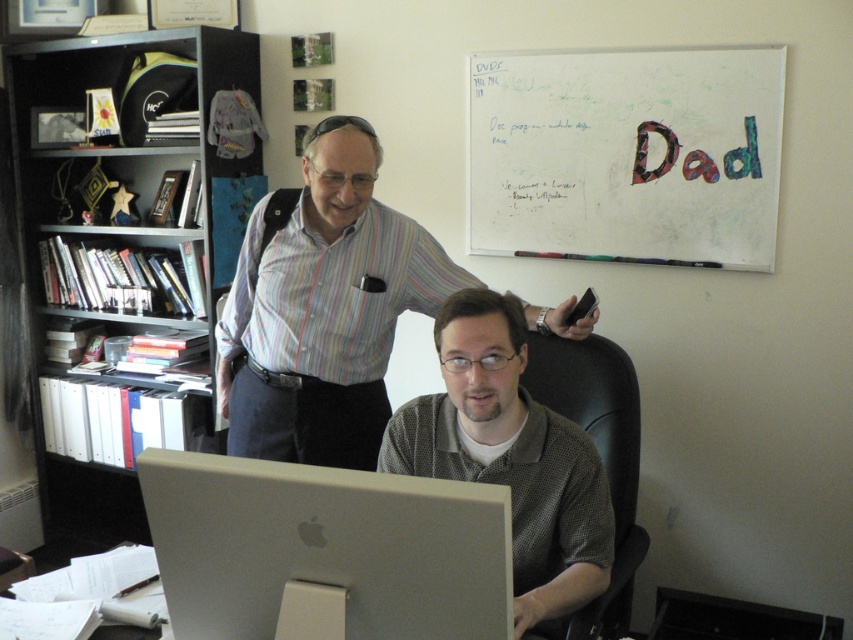
Question: Can you confirm if striped cotton shirt at upper center is positioned to the left of black leather swivel chair at center?

Choices:
 (A) yes
 (B) no

Answer: (A)

Question: Does silver metallic monitor at center come in front of gray dotted shirt at center?

Choices:
 (A) no
 (B) yes

Answer: (B)

Question: Which object is the farthest from the silver metallic monitor at center?

Choices:
 (A) striped cotton shirt at upper center
 (B) black leather swivel chair at center
 (C) black plastic bookshelf at left

Answer: (C)

Question: Which point is farther to the camera?

Choices:
 (A) black leather swivel chair at center
 (B) black plastic bookshelf at left
 (C) gray dotted shirt at center

Answer: (B)

Question: Can you confirm if silver metallic monitor at center is positioned below striped cotton shirt at upper center?

Choices:
 (A) yes
 (B) no

Answer: (A)

Question: Which of the following is the closest to the observer?

Choices:
 (A) (138, 179)
 (B) (450, 412)
 (C) (592, 349)

Answer: (B)